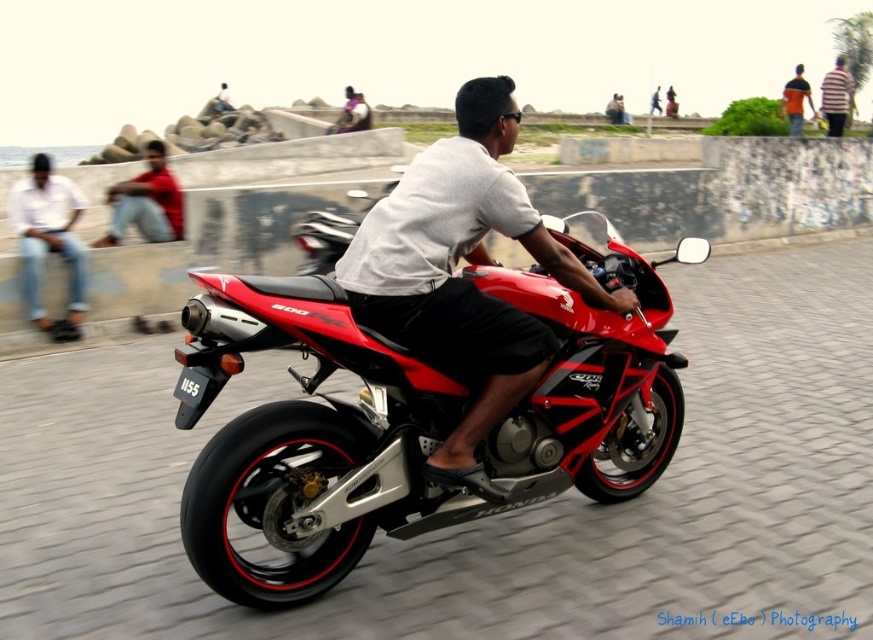
Question: Is the position of white cotton shirt at left more distant than that of orange fabric shirt at upper right?

Choices:
 (A) no
 (B) yes

Answer: (A)

Question: Which object is the closest to the striped shirt at upper right?

Choices:
 (A) white cotton shirt at left
 (B) matte black shirt at center
 (C) shiny red motorcycle at center

Answer: (B)

Question: Which is nearer to the matte red shirt at left?

Choices:
 (A) shiny red motorcycle at center
 (B) striped shirt at upper right

Answer: (A)

Question: Observing the image, what is the correct spatial positioning of matte black shirt at center in reference to orange fabric shirt at upper right?

Choices:
 (A) below
 (B) above

Answer: (A)

Question: From the image, what is the correct spatial relationship of shiny red motorcycle at center in relation to striped shirt at upper right?

Choices:
 (A) below
 (B) above

Answer: (A)

Question: Which object appears closest to the camera in this image?

Choices:
 (A) orange fabric shirt at upper right
 (B) matte red shirt at left
 (C) matte black shirt at center

Answer: (C)